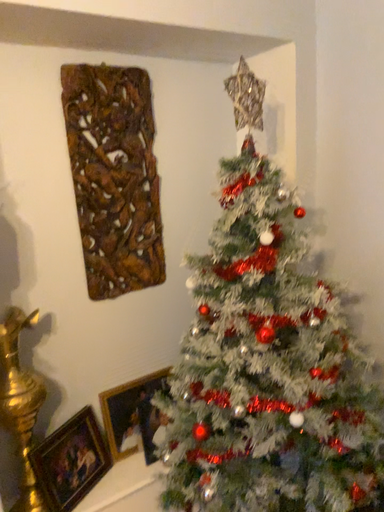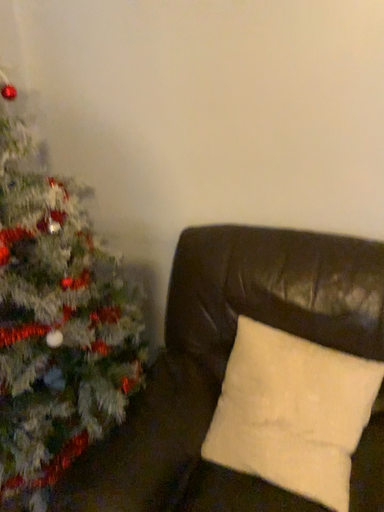
Question: How did the camera likely rotate when shooting the video?

Choices:
 (A) rotated upward
 (B) rotated downward

Answer: (B)